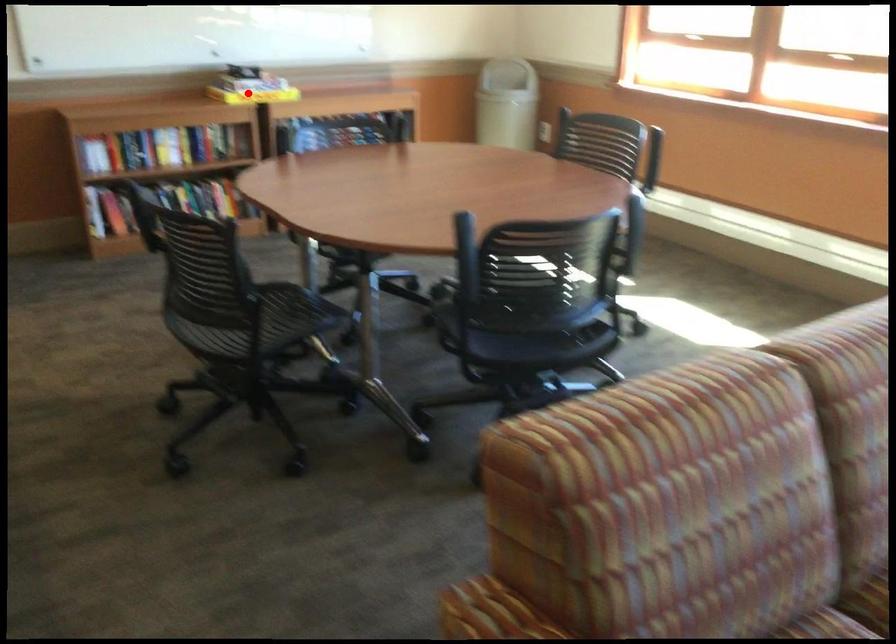
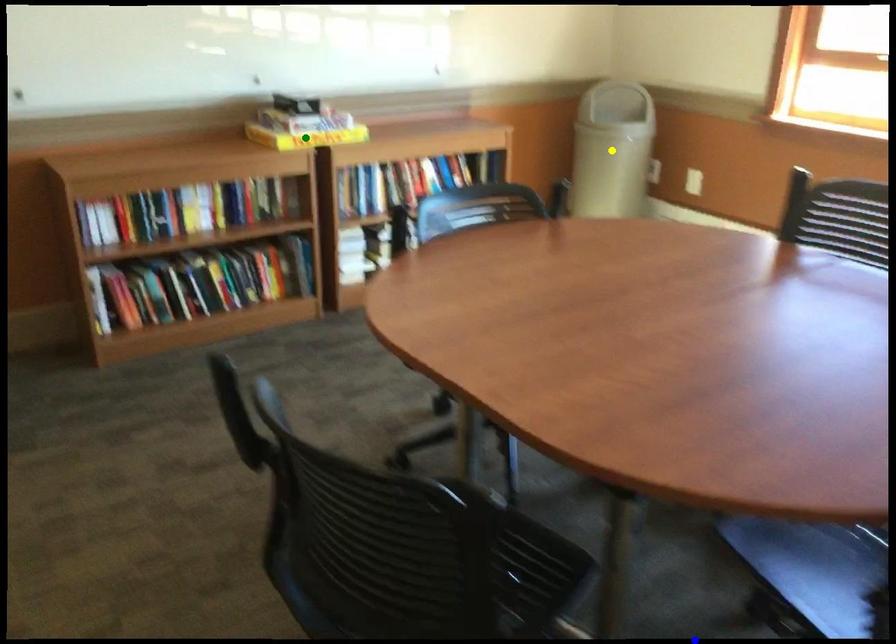
Question: I am providing you with two images of the same scene from different viewpoints. A red point is marked on the first image. You are given multiple points on the second image. Can you choose the point in image 2 that corresponds to the point in image 1?

Choices:
 (A) yellow point
 (B) blue point
 (C) green point

Answer: (C)